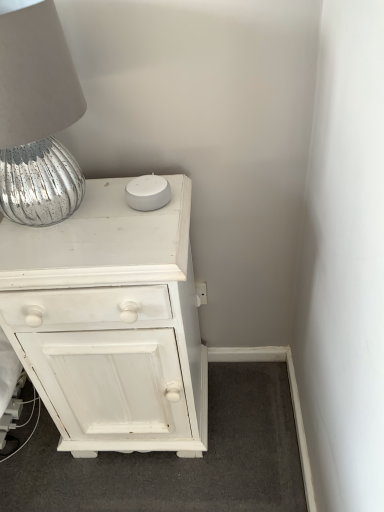
The height and width of the screenshot is (512, 384). What do you see at coordinates (37, 117) in the screenshot?
I see `silver textured lampshade at upper left` at bounding box center [37, 117].

Find the location of a particular element. The height and width of the screenshot is (512, 384). silver textured lampshade at upper left is located at coordinates (37, 117).

Locate an element on the screen. This screenshot has height=512, width=384. white painted wood chest of drawers at upper left is located at coordinates (110, 322).

What do you see at coordinates (110, 322) in the screenshot?
I see `white painted wood chest of drawers at upper left` at bounding box center [110, 322].

Where is `silver textured lampshade at upper left`? This screenshot has width=384, height=512. silver textured lampshade at upper left is located at coordinates (37, 117).

Looking at this image, visually, is silver textured lampshade at upper left positioned to the left or to the right of white painted wood chest of drawers at upper left?

Based on their positions, silver textured lampshade at upper left is located to the left of white painted wood chest of drawers at upper left.

Is silver textured lampshade at upper left positioned before white painted wood chest of drawers at upper left?

Yes, the depth of silver textured lampshade at upper left is less than that of white painted wood chest of drawers at upper left.

Is point (16, 192) behind point (102, 228)?

No, it is in front of (102, 228).

From the image's perspective, is silver textured lampshade at upper left over white painted wood chest of drawers at upper left?

Yes.

From a real-world perspective, is silver textured lampshade at upper left physically located above or below white painted wood chest of drawers at upper left?

From a real-world perspective, silver textured lampshade at upper left is physically above white painted wood chest of drawers at upper left.

In the scene shown: Looking at their sizes, would you say silver textured lampshade at upper left is wider or thinner than white painted wood chest of drawers at upper left?

Considering their sizes, silver textured lampshade at upper left looks slimmer than white painted wood chest of drawers at upper left.

From their relative heights in the image, would you say silver textured lampshade at upper left is taller or shorter than white painted wood chest of drawers at upper left?

In the image, silver textured lampshade at upper left appears to be shorter than white painted wood chest of drawers at upper left.

Based on their sizes in the image, would you say silver textured lampshade at upper left is bigger or smaller than white painted wood chest of drawers at upper left?

In the image, silver textured lampshade at upper left appears to be smaller than white painted wood chest of drawers at upper left.

Do you think silver textured lampshade at upper left is within white painted wood chest of drawers at upper left, or outside of it?

silver textured lampshade at upper left cannot be found inside white painted wood chest of drawers at upper left.

Is silver textured lampshade at upper left beside white painted wood chest of drawers at upper left?

No, silver textured lampshade at upper left is not beside white painted wood chest of drawers at upper left.

Is silver textured lampshade at upper left positioned with its back to white painted wood chest of drawers at upper left?

That's not correct — silver textured lampshade at upper left is not looking away from white painted wood chest of drawers at upper left.

Identify the location of table lamp on the left side of white painted wood chest of drawers at upper left. (37, 117).

Would you say white painted wood chest of drawers at upper left is to the left or to the right of silver textured lampshade at upper left in the picture?

In the image, white painted wood chest of drawers at upper left appears on the right side of silver textured lampshade at upper left.

Is white painted wood chest of drawers at upper left further to camera compared to silver textured lampshade at upper left?

Yes, it is.

Considering the points (118, 247) and (17, 79), which point is behind, point (118, 247) or point (17, 79)?

The point (118, 247) is behind.

From the image's perspective, which one is positioned higher, white painted wood chest of drawers at upper left or silver textured lampshade at upper left?

silver textured lampshade at upper left.

From a real-world perspective, who is located lower, white painted wood chest of drawers at upper left or silver textured lampshade at upper left?

In real-world perspective, white painted wood chest of drawers at upper left is lower.

Based on the photo, which of these two, white painted wood chest of drawers at upper left or silver textured lampshade at upper left, is thinner?

silver textured lampshade at upper left is thinner.

Considering the relative sizes of white painted wood chest of drawers at upper left and silver textured lampshade at upper left in the image provided, is white painted wood chest of drawers at upper left taller than silver textured lampshade at upper left?

Result: Yes.

Is white painted wood chest of drawers at upper left smaller than silver textured lampshade at upper left?

Incorrect, white painted wood chest of drawers at upper left is not smaller in size than silver textured lampshade at upper left.

Can we say white painted wood chest of drawers at upper left lies outside silver textured lampshade at upper left?

That's correct, white painted wood chest of drawers at upper left is outside of silver textured lampshade at upper left.

Is there a large distance between white painted wood chest of drawers at upper left and silver textured lampshade at upper left?

No, white painted wood chest of drawers at upper left is in close proximity to silver textured lampshade at upper left.

Is white painted wood chest of drawers at upper left turned away from silver textured lampshade at upper left?

No, white painted wood chest of drawers at upper left is not facing the opposite direction of silver textured lampshade at upper left.

The height and width of the screenshot is (512, 384). I want to click on table lamp located on the left of white painted wood chest of drawers at upper left, so click(x=37, y=117).

Where is `table lamp positioned vertically above the white painted wood chest of drawers at upper left (from a real-world perspective)`? The height and width of the screenshot is (512, 384). table lamp positioned vertically above the white painted wood chest of drawers at upper left (from a real-world perspective) is located at coordinates (37, 117).

Locate an element on the screen. This screenshot has height=512, width=384. the chest of drawers lying behind the silver textured lampshade at upper left is located at coordinates (110, 322).